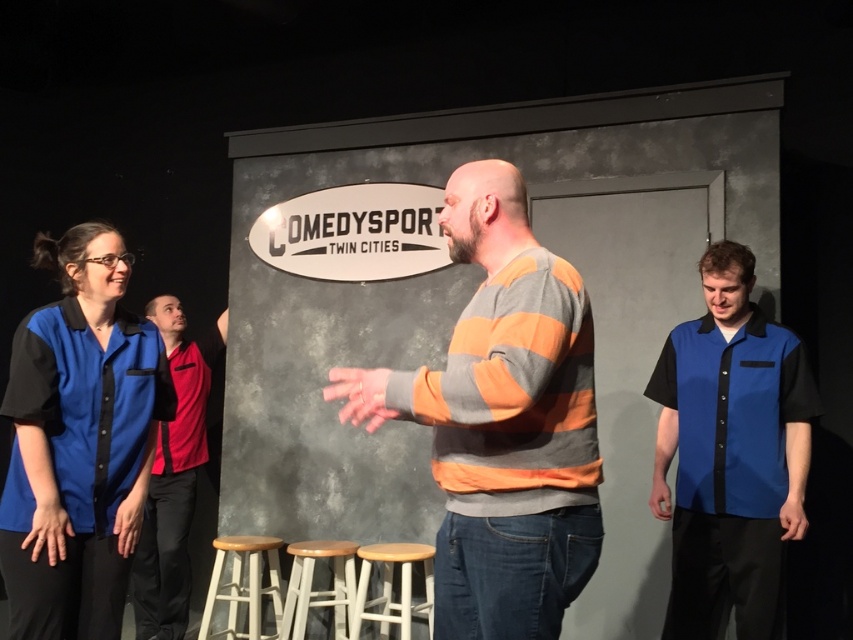
Can you confirm if blue cotton shirt at left is positioned above white wood bar stool at lower center?

Yes, blue cotton shirt at left is above white wood bar stool at lower center.

Is blue cotton shirt at left further to camera compared to white wood bar stool at lower center?

No, blue cotton shirt at left is in front of white wood bar stool at lower center.

What are the coordinates of `blue cotton shirt at left` in the screenshot? It's located at (78, 442).

Who is positioned more to the right, blue cotton shirt at right or red fabric shirt at left?

Positioned to the right is blue cotton shirt at right.

Who is positioned more to the left, blue cotton shirt at right or red fabric shirt at left?

red fabric shirt at left is more to the left.

Describe the element at coordinates (730, 456) in the screenshot. I see `blue cotton shirt at right` at that location.

Locate an element on the screen. blue cotton shirt at right is located at coordinates (730, 456).

How far apart are striped sweater at center and white wood bar stool at lower center?

striped sweater at center and white wood bar stool at lower center are 2.27 meters apart.

Does striped sweater at center appear under white wood bar stool at lower center?

Incorrect, striped sweater at center is not positioned below white wood bar stool at lower center.

Which is in front, point (584, 499) or point (236, 547)?

Point (584, 499)

At what (x,y) coordinates should I click in order to perform the action: click on striped sweater at center. Please return your answer as a coordinate pair (x, y). Looking at the image, I should click on (502, 420).